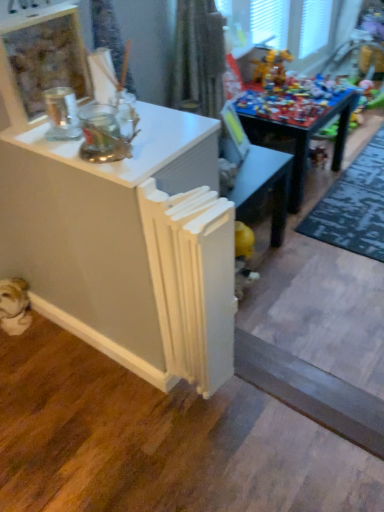
Question: From the image's perspective, does green textured rug at lower right appear higher than shiny plastic toy at upper right?

Choices:
 (A) yes
 (B) no

Answer: (B)

Question: Is green textured rug at lower right further to camera compared to shiny plastic toy at upper right?

Choices:
 (A) yes
 (B) no

Answer: (B)

Question: Considering the relative sizes of green textured rug at lower right and shiny plastic toy at upper right in the image provided, is green textured rug at lower right taller than shiny plastic toy at upper right?

Choices:
 (A) no
 (B) yes

Answer: (A)

Question: Does green textured rug at lower right have a smaller size compared to shiny plastic toy at upper right?

Choices:
 (A) yes
 (B) no

Answer: (B)

Question: Is shiny plastic toy at upper right a part of green textured rug at lower right?

Choices:
 (A) no
 (B) yes

Answer: (A)

Question: Is green textured rug at lower right beside shiny plastic toy at upper right?

Choices:
 (A) yes
 (B) no

Answer: (B)

Question: Can you confirm if white matte radiator at center is positioned to the right of gray matte wood plank at lower right?

Choices:
 (A) no
 (B) yes

Answer: (A)

Question: Is white matte radiator at center not near gray matte wood plank at lower right?

Choices:
 (A) yes
 (B) no

Answer: (B)

Question: Does white matte radiator at center have a greater height compared to gray matte wood plank at lower right?

Choices:
 (A) yes
 (B) no

Answer: (A)

Question: From a real-world perspective, does white matte radiator at center sit lower than gray matte wood plank at lower right?

Choices:
 (A) yes
 (B) no

Answer: (B)

Question: Is white matte radiator at center behind gray matte wood plank at lower right?

Choices:
 (A) no
 (B) yes

Answer: (A)

Question: Considering the relative positions of white matte radiator at center and gray matte wood plank at lower right in the image provided, is white matte radiator at center to the left of gray matte wood plank at lower right from the viewer's perspective?

Choices:
 (A) yes
 (B) no

Answer: (A)

Question: Can you confirm if wooden toy at center is shorter than white matte radiator at center?

Choices:
 (A) yes
 (B) no

Answer: (A)